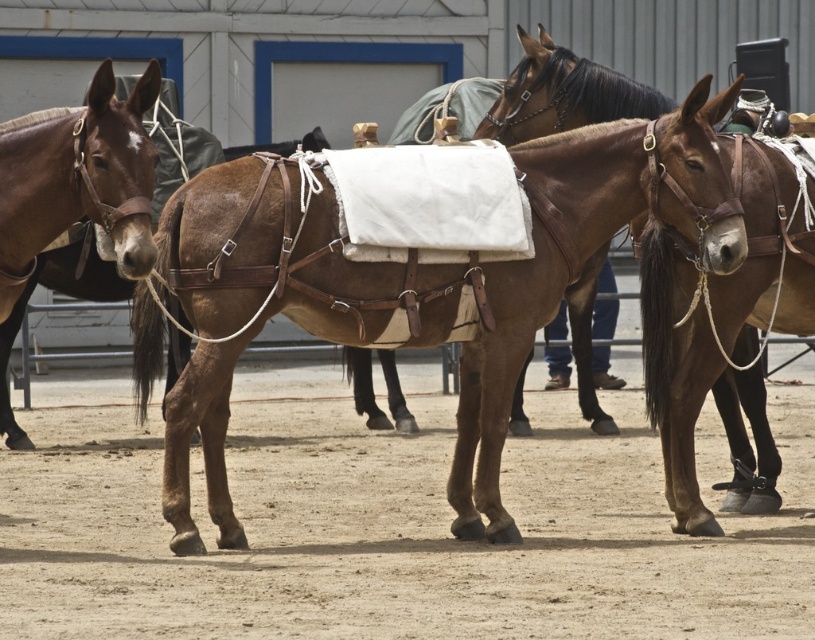
You are a GUI agent. You are given a task and a screenshot of the screen. Output one action in this format:
    pyautogui.click(x=<x>, y=<y>)
    Task: Click on the brown leather saddle at center
    Image resolution: width=815 pixels, height=640 pixels.
    Given the screenshot: What is the action you would take?
    pyautogui.click(x=419, y=284)

Is point (212, 452) positioned behind point (505, 83)?

No, (212, 452) is in front of (505, 83).

Locate an element on the screen. This screenshot has width=815, height=640. brown leather saddle at center is located at coordinates (419, 284).

Locate an element on the screen. This screenshot has width=815, height=640. brown leather saddle at center is located at coordinates (419, 284).

At what (x,y) coordinates should I click in order to perform the action: click on brown leather harness at left. Please return your answer as a coordinate pair (x, y). This screenshot has width=815, height=640. Looking at the image, I should click on (77, 180).

Can you confirm if brown leather harness at left is positioned above brown leather horse at center?

No, brown leather harness at left is not above brown leather horse at center.

This screenshot has height=640, width=815. Find the location of `brown leather harness at left`. brown leather harness at left is located at coordinates (77, 180).

Between brown leather saddle at center and brown leather harness at left, which one has less height?

brown leather harness at left is shorter.

The image size is (815, 640). In order to click on brown leather saddle at center in this screenshot , I will do `click(419, 284)`.

Who is more distant from viewer, (716, 170) or (142, 198)?

Point (716, 170)

I want to click on brown leather saddle at center, so click(419, 284).